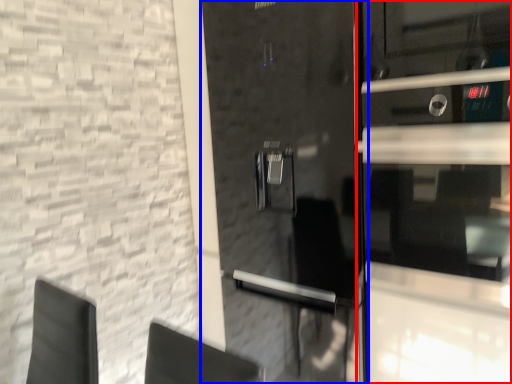
Question: Which point is closer to the camera, glass door (highlighted by a red box) or door (highlighted by a blue box)?

Choices:
 (A) glass door
 (B) door

Answer: (A)